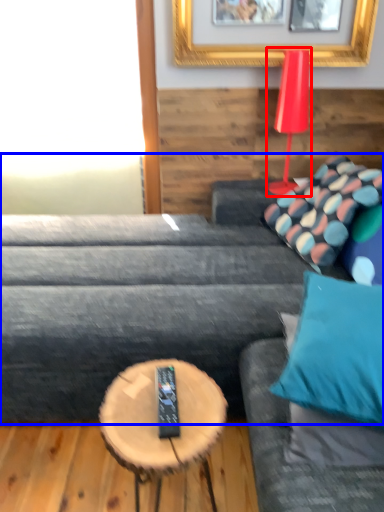
Question: Among these objects, which one is nearest to the camera, table lamp (highlighted by a red box) or studio couch (highlighted by a blue box)?

Choices:
 (A) table lamp
 (B) studio couch

Answer: (B)